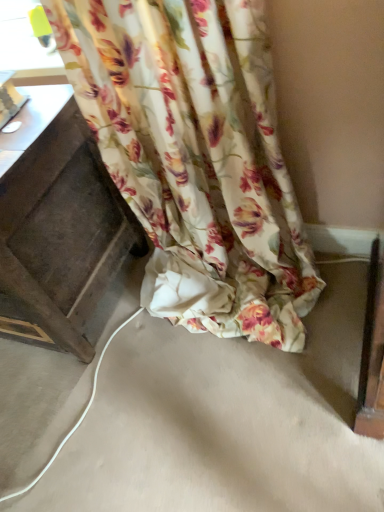
Question: Is dark wood drawer at left positioned with its back to floral fabric curtain at lower center?

Choices:
 (A) no
 (B) yes

Answer: (A)

Question: Is dark wood drawer at left further to the viewer compared to floral fabric curtain at lower center?

Choices:
 (A) yes
 (B) no

Answer: (A)

Question: Is dark wood drawer at left in front of floral fabric curtain at lower center?

Choices:
 (A) no
 (B) yes

Answer: (A)

Question: Is dark wood drawer at left surrounding floral fabric curtain at lower center?

Choices:
 (A) no
 (B) yes

Answer: (A)

Question: Considering the relative positions of dark wood drawer at left and floral fabric curtain at lower center in the image provided, is dark wood drawer at left to the left of floral fabric curtain at lower center from the viewer's perspective?

Choices:
 (A) yes
 (B) no

Answer: (A)

Question: Is dark wood drawer at left smaller than floral fabric curtain at lower center?

Choices:
 (A) no
 (B) yes

Answer: (A)

Question: From a real-world perspective, does floral fabric curtain at lower center stand above dark wood drawer at left?

Choices:
 (A) no
 (B) yes

Answer: (B)

Question: Is floral fabric curtain at lower center oriented towards dark wood drawer at left?

Choices:
 (A) yes
 (B) no

Answer: (B)

Question: Can you confirm if floral fabric curtain at lower center is taller than dark wood drawer at left?

Choices:
 (A) no
 (B) yes

Answer: (B)

Question: Does floral fabric curtain at lower center appear on the right side of dark wood drawer at left?

Choices:
 (A) yes
 (B) no

Answer: (A)

Question: Is floral fabric curtain at lower center positioned behind dark wood drawer at left?

Choices:
 (A) yes
 (B) no

Answer: (B)

Question: Is floral fabric curtain at lower center oriented away from dark wood drawer at left?

Choices:
 (A) no
 (B) yes

Answer: (A)

Question: Can you confirm if dark wood drawer at left is wider than transparent plastic window at upper left?

Choices:
 (A) no
 (B) yes

Answer: (B)